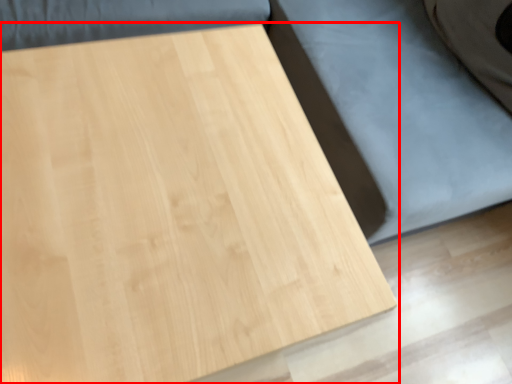
Question: Where is table (annotated by the red box) located in relation to bed frame in the image?

Choices:
 (A) left
 (B) right

Answer: (A)